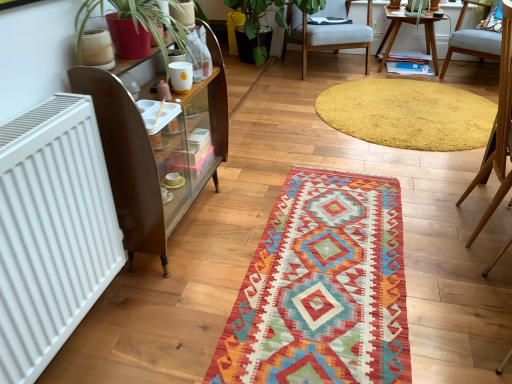
This screenshot has width=512, height=384. Find the location of `vacant space that is in between brown wooden shelf at left and white matte radiator at left`. vacant space that is in between brown wooden shelf at left and white matte radiator at left is located at coordinates [135, 309].